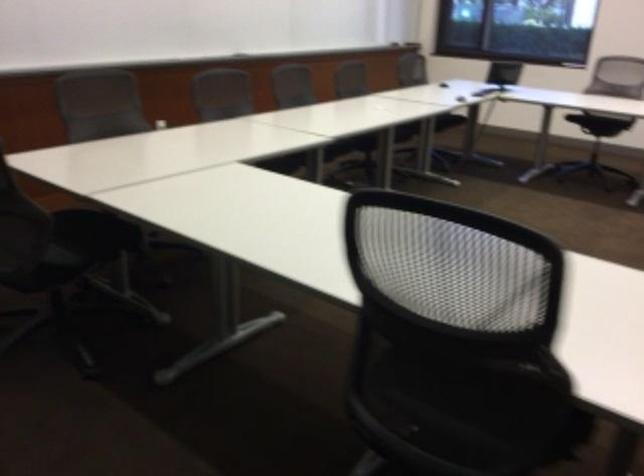
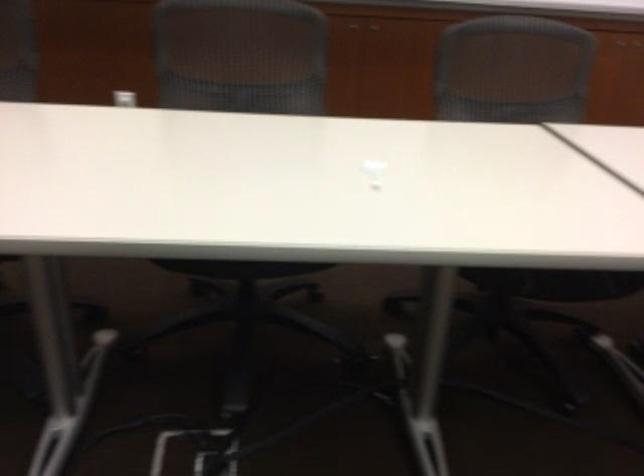
Where in the second image is the point corresponding to (x=166, y=120) from the first image?

(125, 96)